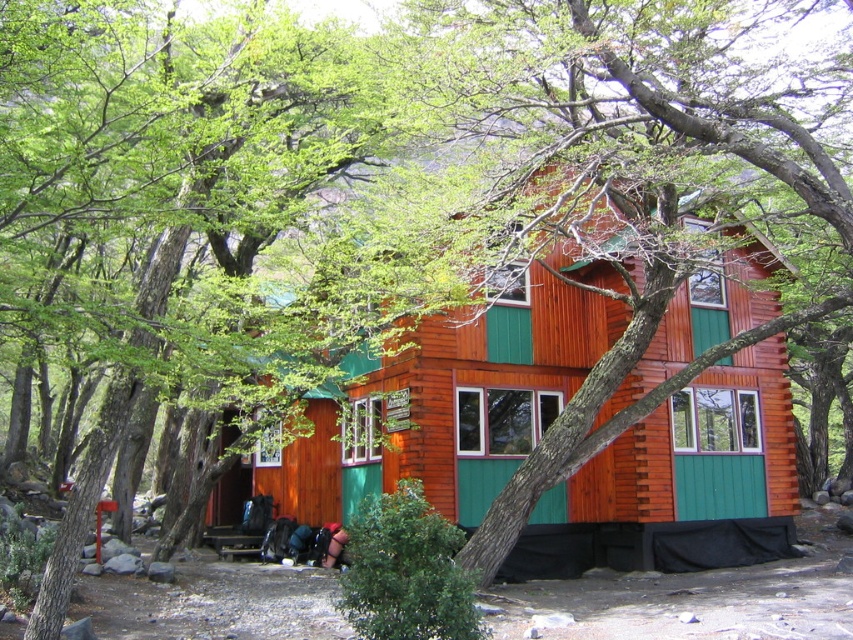
Describe the element at coordinates (675, 483) in the screenshot. I see `wooden cabin at center` at that location.

The height and width of the screenshot is (640, 853). I want to click on wooden cabin at center, so click(675, 483).

Locate an element on the screen. This screenshot has height=640, width=853. wooden cabin at center is located at coordinates (675, 483).